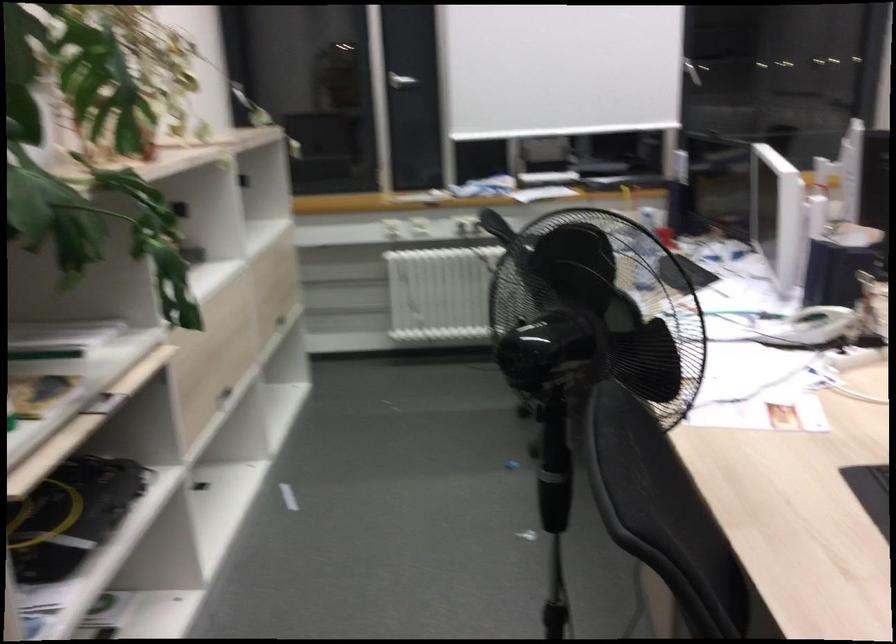
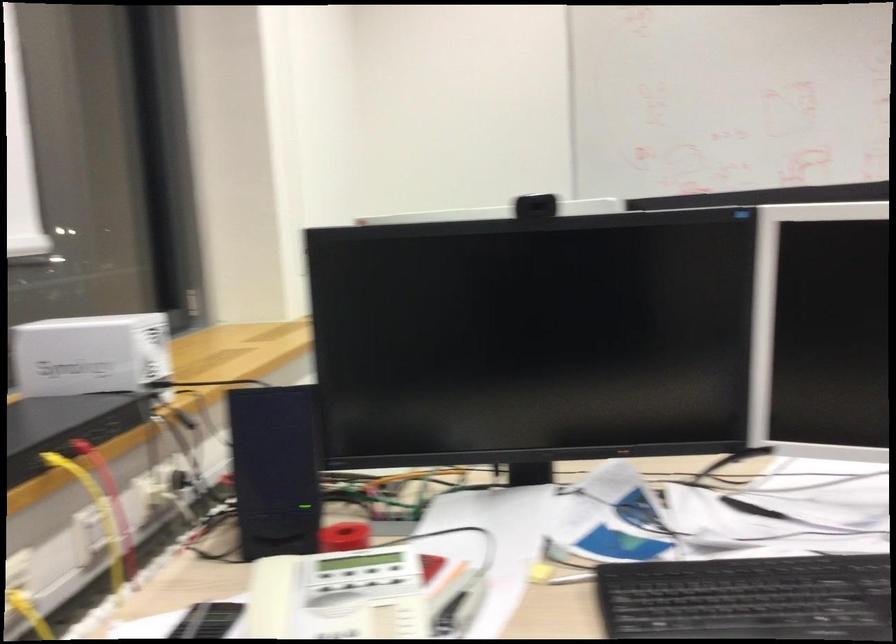
In the second image, find the point that corresponds to pixel 675 162 in the first image.

(90, 354)